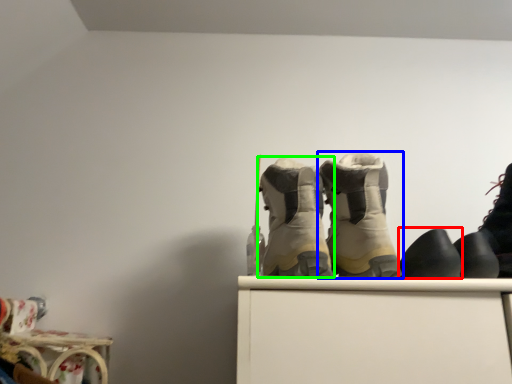
Question: Estimate the real-world distances between objects in this image. Which object is closer to footwear (highlighted by a red box), footwear (highlighted by a blue box) or footwear (highlighted by a green box)?

Choices:
 (A) footwear
 (B) footwear

Answer: (A)